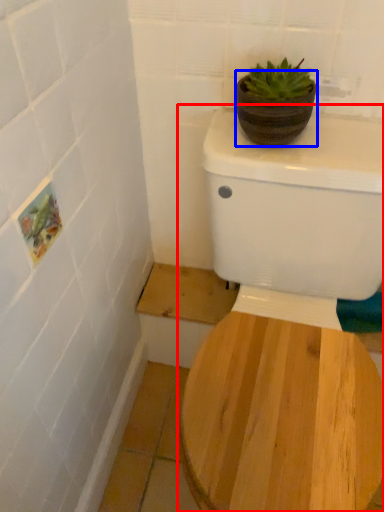
Question: Which of the following is the farthest to the observer, toilet (highlighted by a red box) or flowerpot (highlighted by a blue box)?

Choices:
 (A) toilet
 (B) flowerpot

Answer: (B)